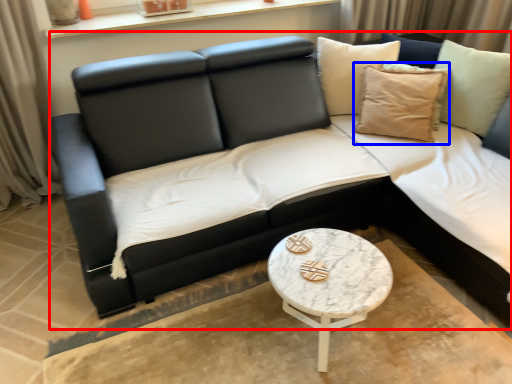
Question: Among these objects, which one is nearest to the camera, studio couch (highlighted by a red box) or pillow (highlighted by a blue box)?

Choices:
 (A) studio couch
 (B) pillow

Answer: (A)